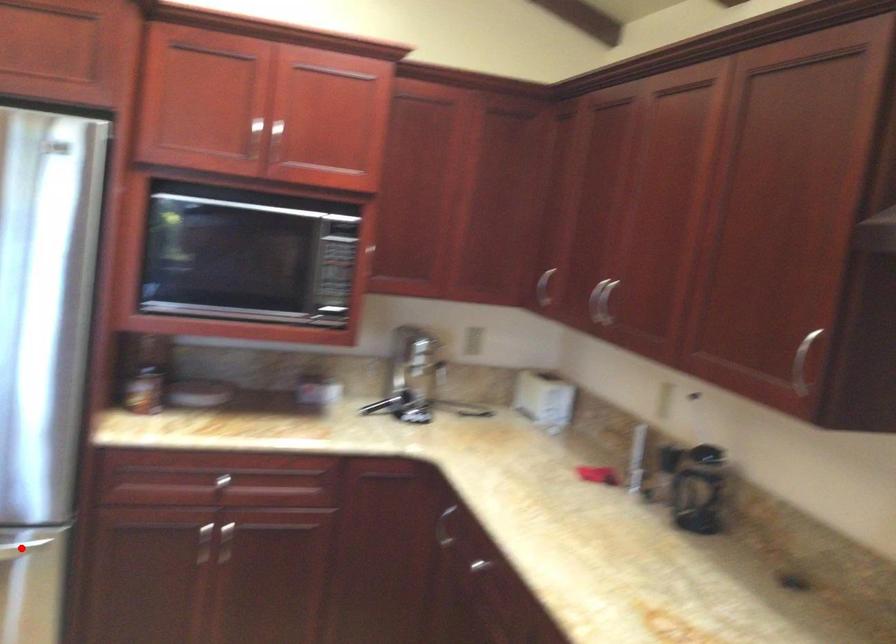
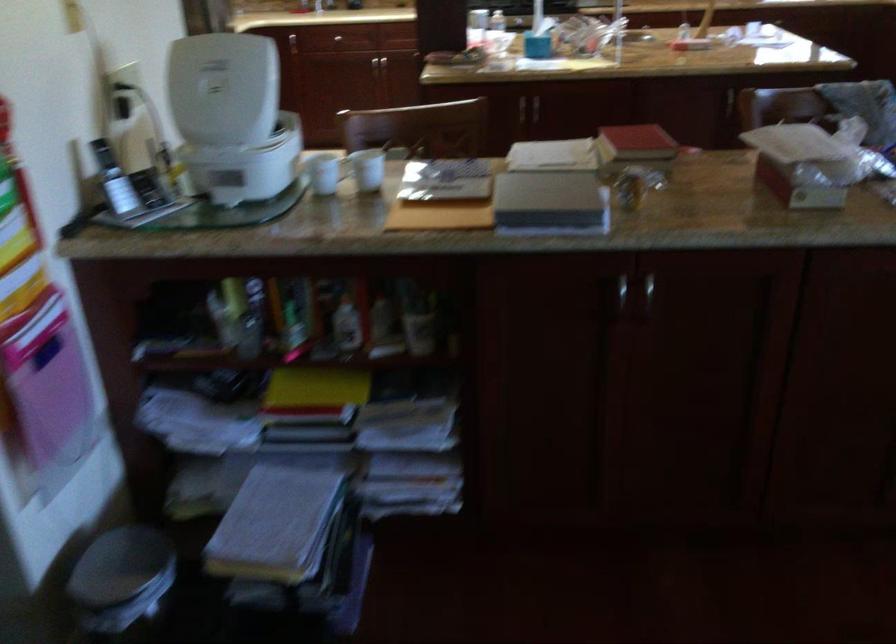
Question: I am providing you with two images of the same scene from different viewpoints. A red point is marked on the first image. Is the red point's position out of view in image 2?

Choices:
 (A) Yes
 (B) No

Answer: (A)